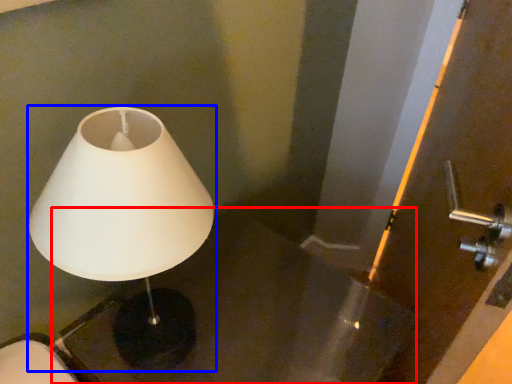
Question: Among these objects, which one is farthest to the camera, table (highlighted by a red box) or lamp (highlighted by a blue box)?

Choices:
 (A) table
 (B) lamp

Answer: (A)